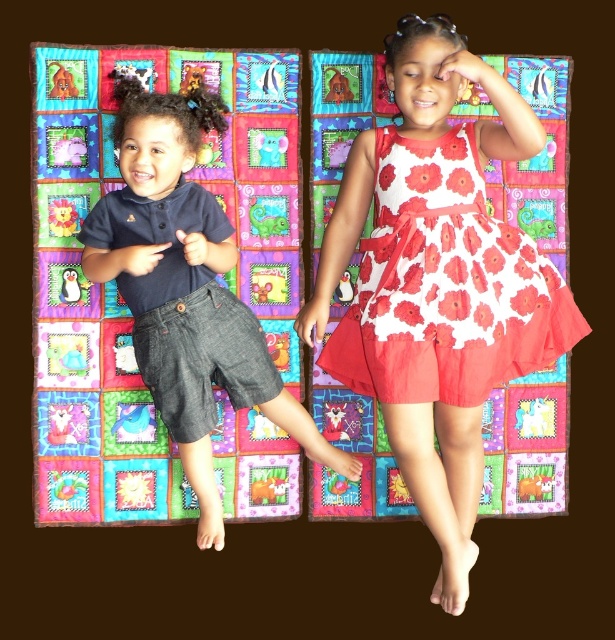
What do you see at coordinates (437, 282) in the screenshot?
I see `white floral dress at center` at bounding box center [437, 282].

Between white floral dress at center and denim shorts at left, which one is positioned higher?

denim shorts at left

This screenshot has width=615, height=640. What do you see at coordinates (437, 282) in the screenshot? I see `white floral dress at center` at bounding box center [437, 282].

Locate an element on the screen. This screenshot has height=640, width=615. white floral dress at center is located at coordinates (437, 282).

Between point (33, 45) and point (407, 340), which one is positioned in front?

Point (407, 340) is more forward.

Is point (49, 198) positioned after point (560, 301)?

Yes.

The height and width of the screenshot is (640, 615). What are the coordinates of `multicolored quilt at center` in the screenshot? It's located at coord(218,276).

Is point (279, 310) farther from viewer compared to point (306, 452)?

Yes, point (279, 310) is behind point (306, 452).

Does point (494, 173) come closer to viewer compared to point (202, 264)?

No.

Which is behind, point (341, 506) or point (167, 220)?

Point (341, 506)

Where is `multicolored quilt at center`? The height and width of the screenshot is (640, 615). multicolored quilt at center is located at coordinates (218, 276).